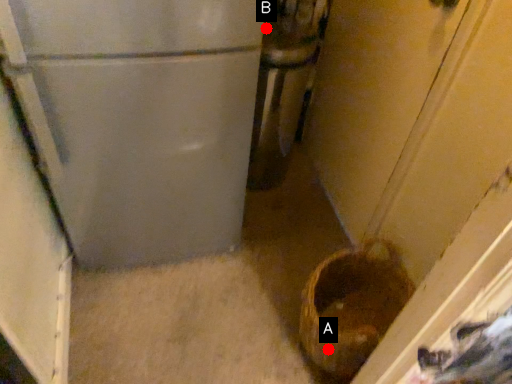
Question: Two points are circled on the image, labeled by A and B beside each circle. Which point is farther from the camera taking this photo?

Choices:
 (A) A is further
 (B) B is further

Answer: (B)